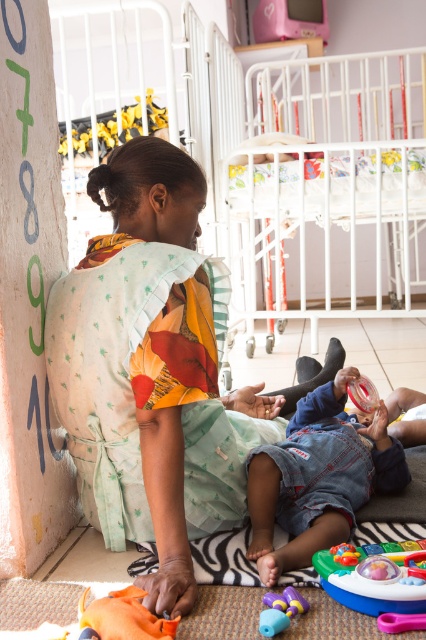
Question: Does printed fabric dress at center have a smaller size compared to white metal crib at upper center?

Choices:
 (A) yes
 (B) no

Answer: (A)

Question: Which object is positioned closest to the printed fabric dress at center?

Choices:
 (A) multicolored plastic toy at lower right
 (B) white metal crib at upper center
 (C) translucent purple toy at lower center

Answer: (A)

Question: Which point appears farthest from the camera in this image?

Choices:
 (A) (161, 518)
 (B) (374, 573)
 (C) (382, 257)
 (D) (379, 488)

Answer: (C)

Question: Which of the following is the closest to the observer?

Choices:
 (A) (284, 602)
 (B) (321, 500)
 (C) (147, 216)
 (D) (383, 52)

Answer: (A)

Question: In this image, where is white metal crib at upper center located relative to denim jeans at lower center?

Choices:
 (A) left
 (B) right

Answer: (B)

Question: In this image, where is printed fabric dress at center located relative to white metal crib at upper center?

Choices:
 (A) below
 (B) above

Answer: (A)